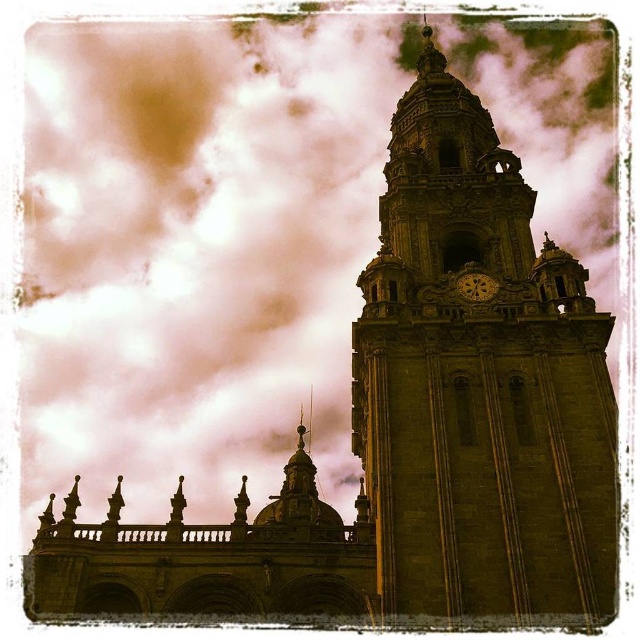
Does green stone clock tower at upper right have a larger size compared to gold textured clock at upper center?

Yes.

Can you confirm if green stone clock tower at upper right is positioned to the left of gold textured clock at upper center?

No, green stone clock tower at upper right is not to the left of gold textured clock at upper center.

Who is more forward, (452, 244) or (464, 298)?

Point (464, 298) is more forward.

This screenshot has width=640, height=640. Identify the location of green stone clock tower at upper right. coord(480,385).